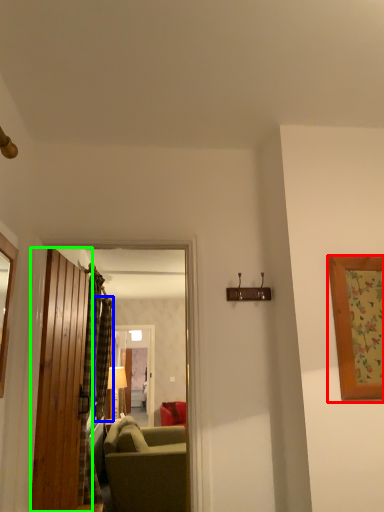
Question: Considering the real-world distances, which object is closest to picture frame (highlighted by a red box)? curtain (highlighted by a blue box) or door (highlighted by a green box).

Choices:
 (A) curtain
 (B) door

Answer: (B)